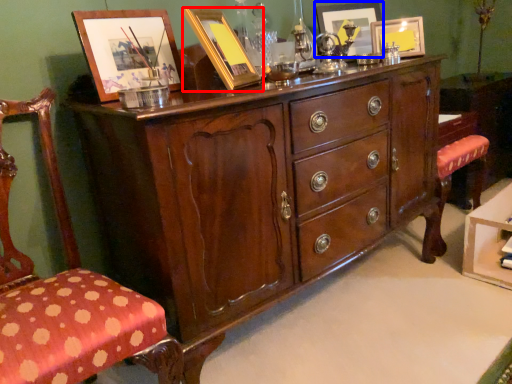
Question: Among these objects, which one is farthest to the camera, picture frame (highlighted by a red box) or picture frame (highlighted by a blue box)?

Choices:
 (A) picture frame
 (B) picture frame

Answer: (B)